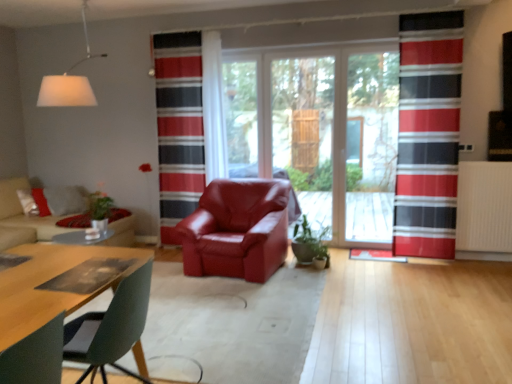
Image resolution: width=512 pixels, height=384 pixels. What do you see at coordinates (308, 243) in the screenshot?
I see `green glossy plant at center` at bounding box center [308, 243].

In order to face satin red armchair at center, should I rotate leftwards or rightwards?

To align with it, rotate left about 2.241°.

This screenshot has height=384, width=512. In order to click on red striped curtain at center, marked as the first curtain in a left-to-right arrangement in this screenshot , I will do point(179,127).

What do you see at coordinates (179, 127) in the screenshot? I see `red striped curtain at center, the 2th curtain when ordered from right to left` at bounding box center [179, 127].

Measure the distance between white matte lampshade at upper left and camera.

3.53 meters.

Locate an element on the screen. transparent glass screen door at center, placed as the 2th screen door when sorted from right to left is located at coordinates (304, 132).

This screenshot has height=384, width=512. Describe the element at coordinates (484, 211) in the screenshot. I see `white textured radiator at right` at that location.

At what (x,y) coordinates should I click in order to perform the action: click on green glossy plant at center. Please return your answer as a coordinate pair (x, y). This screenshot has height=384, width=512. Looking at the image, I should click on (308, 243).

Which object is thinner, green glossy plant at center or red striped curtain at center, acting as the first curtain starting from the back?

red striped curtain at center, acting as the first curtain starting from the back, is thinner.

How far apart are green glossy plant at center and red striped curtain at center, acting as the first curtain starting from the back?

green glossy plant at center is 1.67 meters away from red striped curtain at center, acting as the first curtain starting from the back.

From a real-world perspective, is green glossy plant at center physically above red striped curtain at center, the 2th curtain when ordered from right to left?

No, from a real-world perspective, green glossy plant at center is not over red striped curtain at center, the 2th curtain when ordered from right to left

Does green glossy plant at center turn towards red striped curtain at center, the 2th curtain when ordered from right to left?

No, green glossy plant at center is not facing towards red striped curtain at center, the 2th curtain when ordered from right to left.

Based on the photo, from the image's perspective, between transparent glass screen door at center, placed as the 2th screen door when sorted from right to left, and satin red armchair at center, which one is located above?

transparent glass screen door at center, placed as the 2th screen door when sorted from right to left.

Considering the positions of objects transparent glass screen door at center, arranged as the first screen door when viewed from the left, and satin red armchair at center in the image provided, who is in front, transparent glass screen door at center, arranged as the first screen door when viewed from the left, or satin red armchair at center?

Positioned in front is satin red armchair at center.

Can you confirm if transparent glass screen door at center, placed as the 2th screen door when sorted from right to left, is positioned to the right of satin red armchair at center?

Yes.

I want to click on chair lying below the transparent glass screen door at center, placed as the 2th screen door when sorted from right to left (from the image's perspective), so click(x=237, y=229).

Which is more to the right, transparent glass screen door at center, which is counted as the first screen door, starting from the right, or red striped curtain at right, which is counted as the 1th curtain, starting from the right?

From the viewer's perspective, red striped curtain at right, which is counted as the 1th curtain, starting from the right, appears more on the right side.

Between transparent glass screen door at center, the 2th screen door when ordered from left to right, and red striped curtain at right, which is the second curtain from left to right, which one is positioned behind?

transparent glass screen door at center, the 2th screen door when ordered from left to right, is more distant.

Could red striped curtain at right, which is counted as the 1th curtain, starting from the right, be considered to be inside transparent glass screen door at center, the 2th screen door when ordered from left to right?

Definitely not — red striped curtain at right, which is counted as the 1th curtain, starting from the right, is not inside transparent glass screen door at center, the 2th screen door when ordered from left to right.

Considering the points (386, 142) and (434, 39), which point is in front, point (386, 142) or point (434, 39)?

The point (434, 39) is more forward.

Is white matte lampshade at upper left to the right of transparent glass screen door at center, the 2th screen door when ordered from left to right, from the viewer's perspective?

No, white matte lampshade at upper left is not to the right of transparent glass screen door at center, the 2th screen door when ordered from left to right.

Based on the photo, which is behind, white matte lampshade at upper left or transparent glass screen door at center, the 2th screen door when ordered from left to right?

Positioned behind is transparent glass screen door at center, the 2th screen door when ordered from left to right.

Which point is more forward, (x=81, y=104) or (x=379, y=204)?

Point (x=81, y=104)

In the scene shown: Is white matte lampshade at upper left not near transparent glass screen door at center, the 2th screen door when ordered from left to right?

Yes, white matte lampshade at upper left is far from transparent glass screen door at center, the 2th screen door when ordered from left to right.

Could you tell me if white matte lampshade at upper left is facing transparent glass screen door at center, arranged as the first screen door when viewed from the left?

No, white matte lampshade at upper left is not aimed at transparent glass screen door at center, arranged as the first screen door when viewed from the left.

Between white matte lampshade at upper left and transparent glass screen door at center, placed as the 2th screen door when sorted from right to left, which one has smaller size?

transparent glass screen door at center, placed as the 2th screen door when sorted from right to left.

Considering the positions of objects white matte lampshade at upper left and transparent glass screen door at center, placed as the 2th screen door when sorted from right to left, in the image provided, who is in front, white matte lampshade at upper left or transparent glass screen door at center, placed as the 2th screen door when sorted from right to left,?

white matte lampshade at upper left is in front.

Is white matte lampshade at upper left beside transparent glass screen door at center, placed as the 2th screen door when sorted from right to left?

No, white matte lampshade at upper left is not in contact with transparent glass screen door at center, placed as the 2th screen door when sorted from right to left.

This screenshot has width=512, height=384. Find the location of `radiator to the right of transparent glass window at center`. radiator to the right of transparent glass window at center is located at coordinates (484, 211).

Is transparent glass window at center located within white textured radiator at right?

No, white textured radiator at right does not contain transparent glass window at center.

From a real-world perspective, is white textured radiator at right positioned over transparent glass window at center based on gravity?

No, from a real-world perspective, white textured radiator at right is not over transparent glass window at center

Is red striped curtain at center, the 2th curtain viewed from the front, at the right side of beige fabric couch at left?

Indeed, red striped curtain at center, the 2th curtain viewed from the front, is positioned on the right side of beige fabric couch at left.

From the image's perspective, does red striped curtain at center, the 2th curtain when ordered from right to left, appear higher than beige fabric couch at left?

Yes, from the image's perspective, red striped curtain at center, the 2th curtain when ordered from right to left, is on top of beige fabric couch at left.

Choose the correct answer: Is red striped curtain at center, acting as the first curtain starting from the back, inside beige fabric couch at left or outside it?

red striped curtain at center, acting as the first curtain starting from the back, is not enclosed by beige fabric couch at left.

From a real-world perspective, is red striped curtain at center, acting as the first curtain starting from the back, on top of beige fabric couch at left?

Yes, from a real-world perspective, red striped curtain at center, acting as the first curtain starting from the back, is over beige fabric couch at left

From a real-world perspective, which curtain is the 1st one above the green glossy plant at center? Please provide its 2D coordinates.

[(179, 127)]

I want to click on chair in front of the transparent glass screen door at center, arranged as the first screen door when viewed from the left, so click(237, 229).

From the image, which object appears to be farther from white matte lampshade at upper left, transparent glass screen door at center, placed as the 2th screen door when sorted from right to left, or green glossy plant at center?

Among the two, transparent glass screen door at center, placed as the 2th screen door when sorted from right to left, is located further to white matte lampshade at upper left.

Which object lies further to the anchor point red striped curtain at center, acting as the first curtain starting from the back, satin red armchair at center or white matte lampshade at upper left?

white matte lampshade at upper left is further to red striped curtain at center, acting as the first curtain starting from the back.

Looking at this image, considering their positions, is beige fabric couch at left positioned closer to green glossy plant at center than satin red armchair at center?

satin red armchair at center.

Based on their spatial positions, is red striped curtain at right, acting as the 1th curtain starting from the front, or transparent glass screen door at center, placed as the 2th screen door when sorted from right to left, closer to transparent glass screen door at center, which is counted as the first screen door, starting from the right?

The object closer to transparent glass screen door at center, which is counted as the first screen door, starting from the right, is transparent glass screen door at center, placed as the 2th screen door when sorted from right to left.

Estimate the real-world distances between objects in this image. Which object is further from transparent glass screen door at center, which is counted as the first screen door, starting from the right, green glossy plant at center or red striped curtain at center, the 2th curtain viewed from the front?

Based on the image, red striped curtain at center, the 2th curtain viewed from the front, appears to be further to transparent glass screen door at center, which is counted as the first screen door, starting from the right.

Based on their spatial positions, is green glossy plant at center or white textured radiator at right further from satin red armchair at center?

Among the two, white textured radiator at right is located further to satin red armchair at center.

Looking at the image, which one is located closer to satin red armchair at center, white matte lampshade at upper left or beige fabric couch at left?

beige fabric couch at left lies closer to satin red armchair at center than the other object.

Looking at the image, which one is located closer to satin red armchair at center, green glossy plant at center or transparent glass window at center?

Based on the image, green glossy plant at center appears to be nearer to satin red armchair at center.

The height and width of the screenshot is (384, 512). I want to click on curtain situated between red striped curtain at center, acting as the first curtain starting from the back, and white textured radiator at right from left to right, so click(428, 134).

Find the location of a particular element. This screenshot has width=512, height=384. screen door situated between transparent glass screen door at center, placed as the 2th screen door when sorted from right to left, and red striped curtain at right, which is the second curtain from left to right, from left to right is located at coordinates (371, 145).

You are a GUI agent. You are given a task and a screenshot of the screen. Output one action in this format:
    pyautogui.click(x=<x>, y=<y>)
    Task: Click on the houseplant between satin red armchair at center and transparent glass screen door at center, placed as the 2th screen door when sorted from right to left, along the z-axis
    This screenshot has height=384, width=512.
    Given the screenshot: What is the action you would take?
    pyautogui.click(x=308, y=243)

Find the location of a particular element. The image size is (512, 384). window screen between beige fabric couch at left and transparent glass screen door at center, the 2th screen door when ordered from left to right is located at coordinates (241, 117).